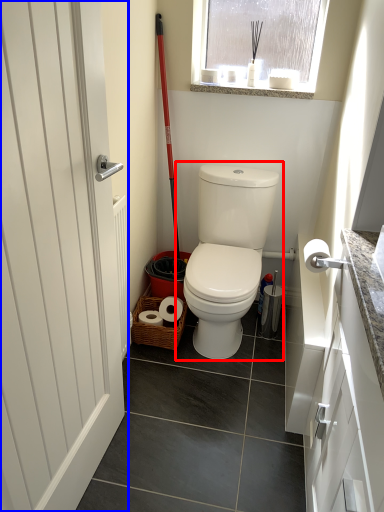
Question: Which object is closer to the camera taking this photo, toilet (highlighted by a red box) or door (highlighted by a blue box)?

Choices:
 (A) toilet
 (B) door

Answer: (B)